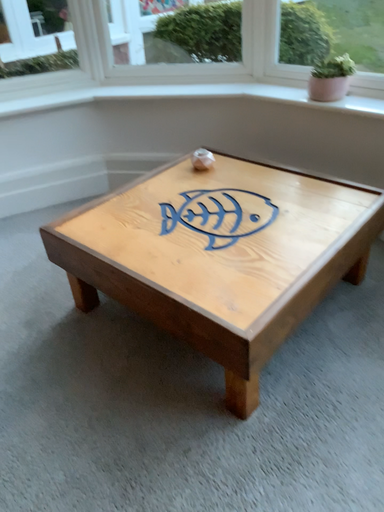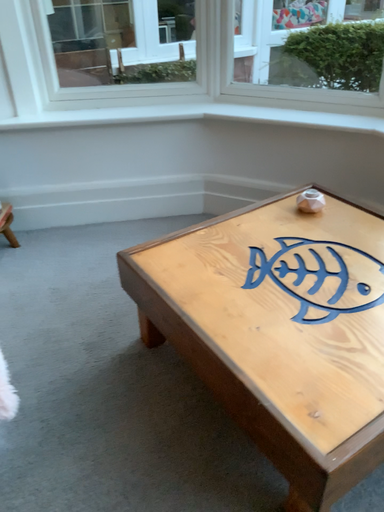
Question: Which way did the camera rotate in the video?

Choices:
 (A) rotated right
 (B) rotated left

Answer: (B)